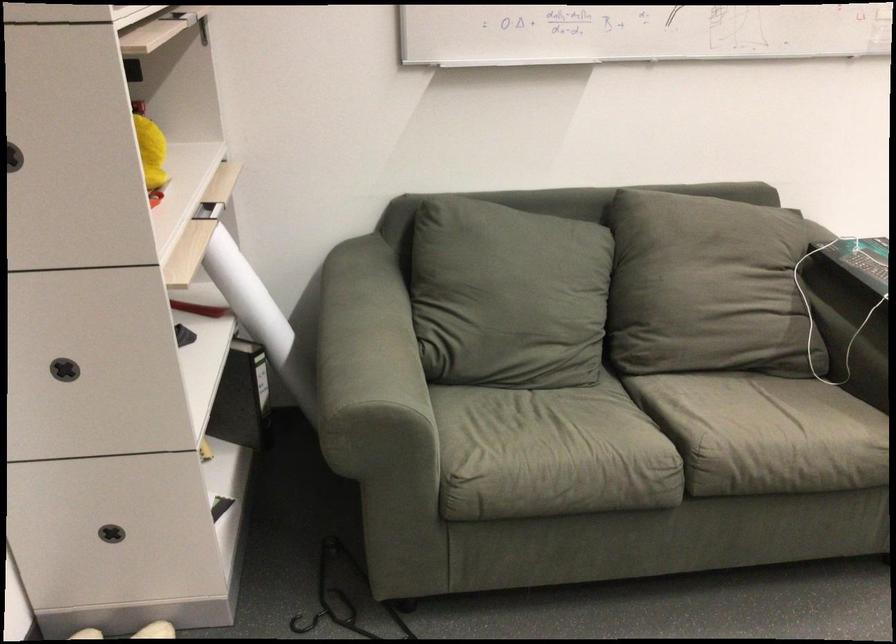
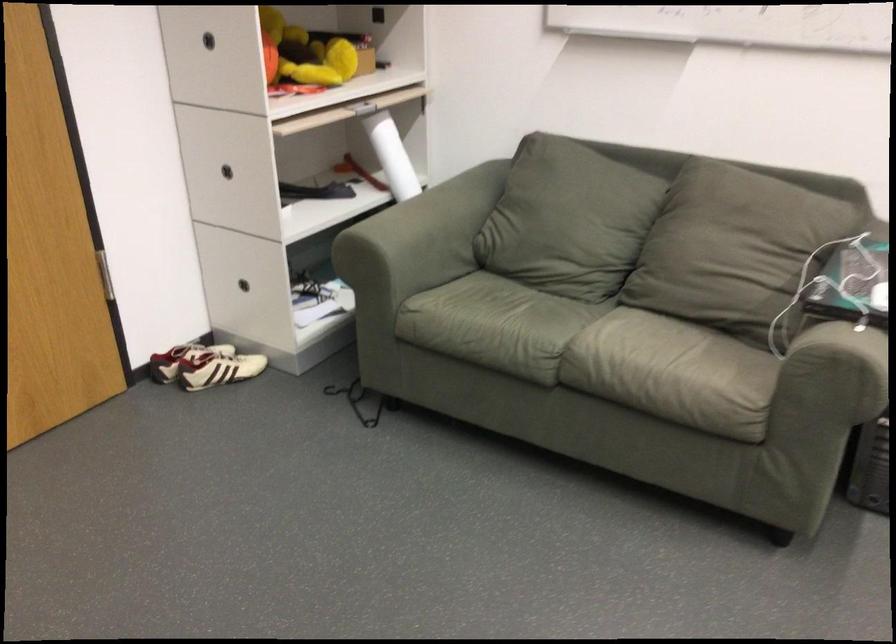
The point at (730, 279) is marked in the first image. Where is the corresponding point in the second image?

(728, 243)